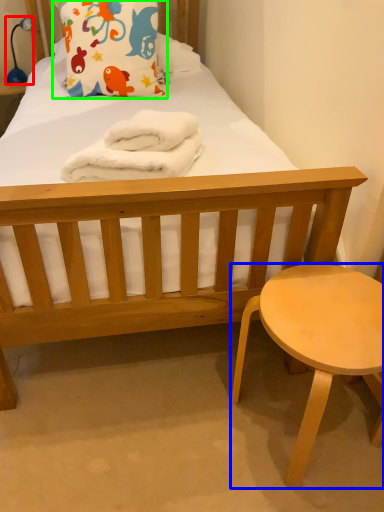
Question: Estimate the real-world distances between objects in this image. Which object is closer to lamp (highlighted by a red box), stool (highlighted by a blue box) or pillow (highlighted by a green box)?

Choices:
 (A) stool
 (B) pillow

Answer: (B)